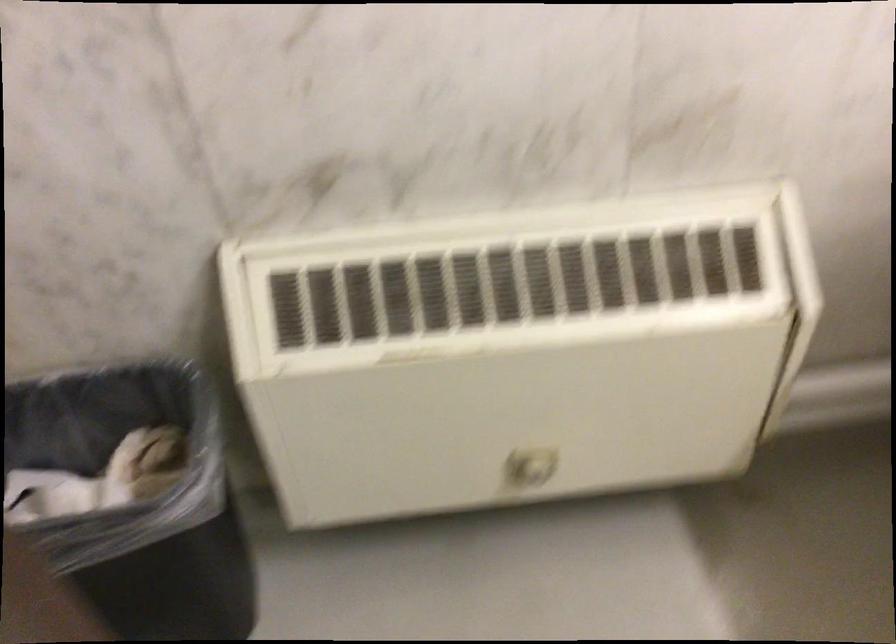
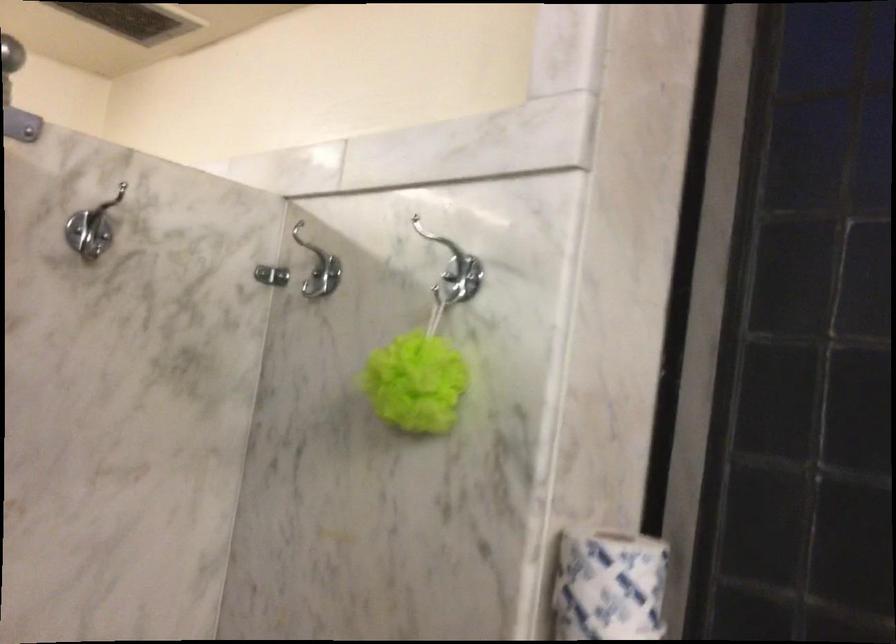
From the picture: Based on the continuous images, in which direction is the camera rotating?

The camera's rotation is toward left-up.